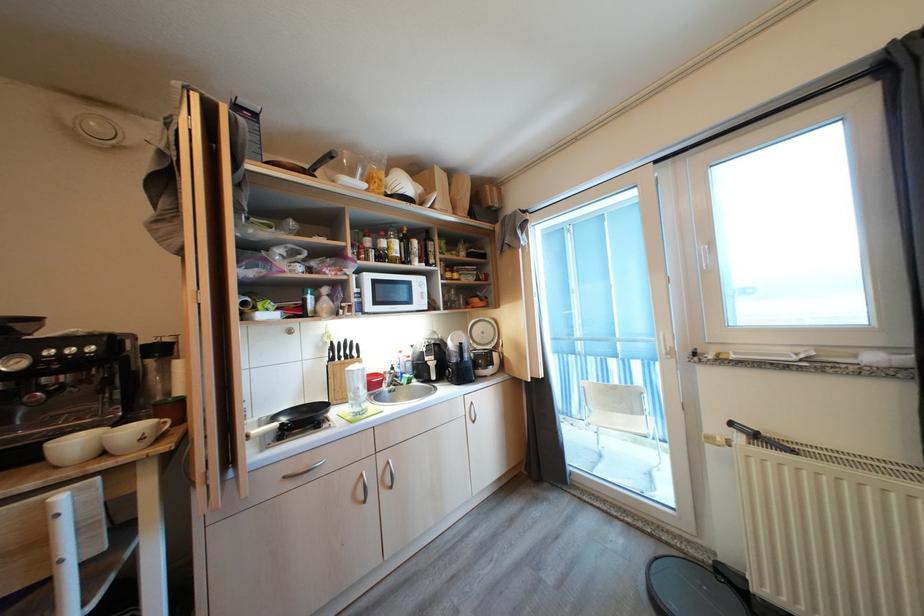
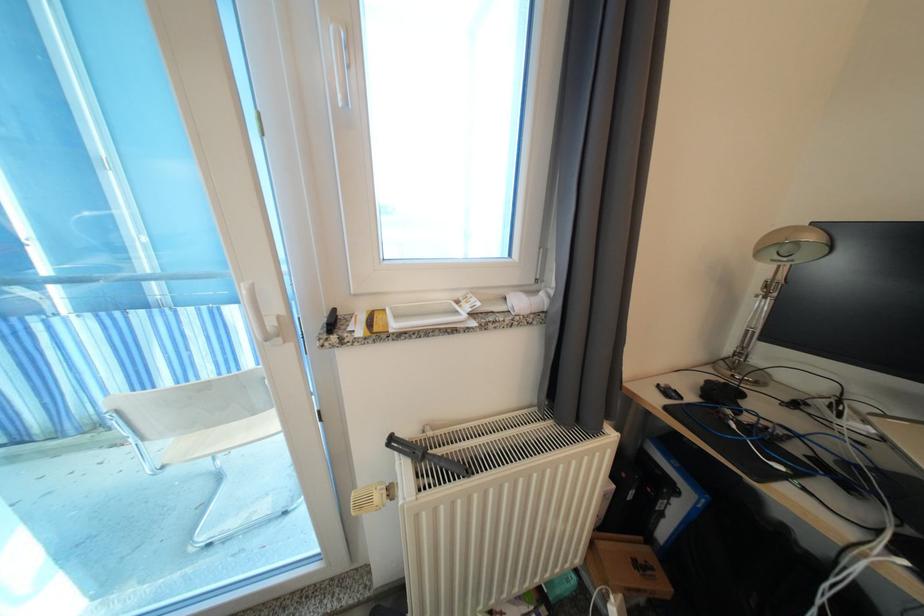
In the second image, find the point that corresponds to (736,428) in the first image.

(395, 445)